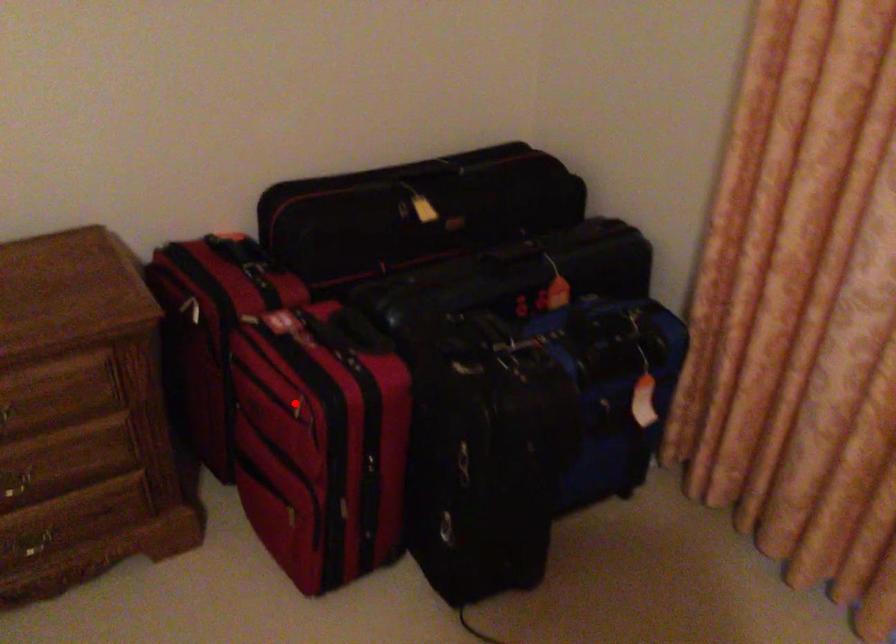
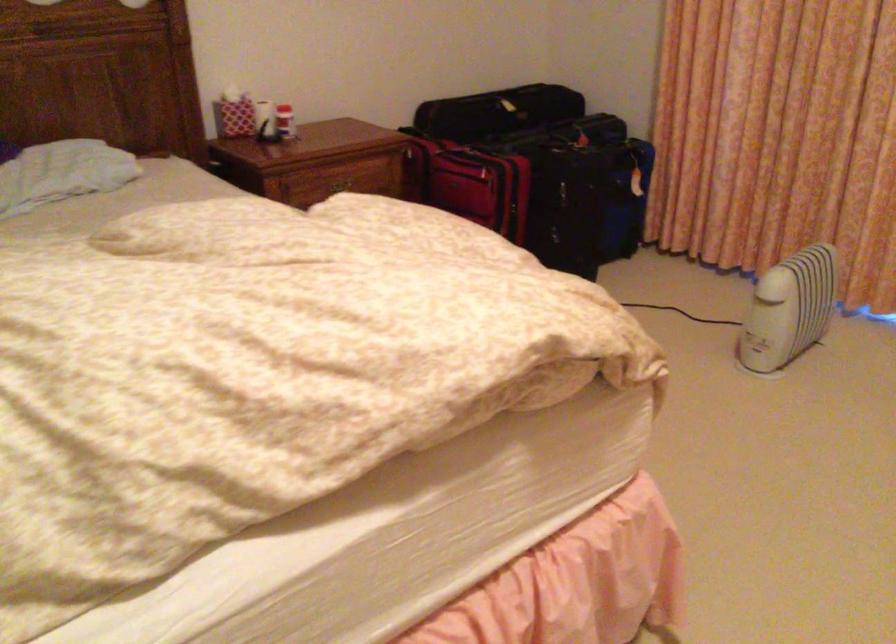
Question: I am providing you with two images of the same scene from different viewpoints. A red point is shown in image1. For the corresponding object point in image2, is it positioned nearer or farther from the camera?

Choices:
 (A) Nearer
 (B) Farther

Answer: (B)